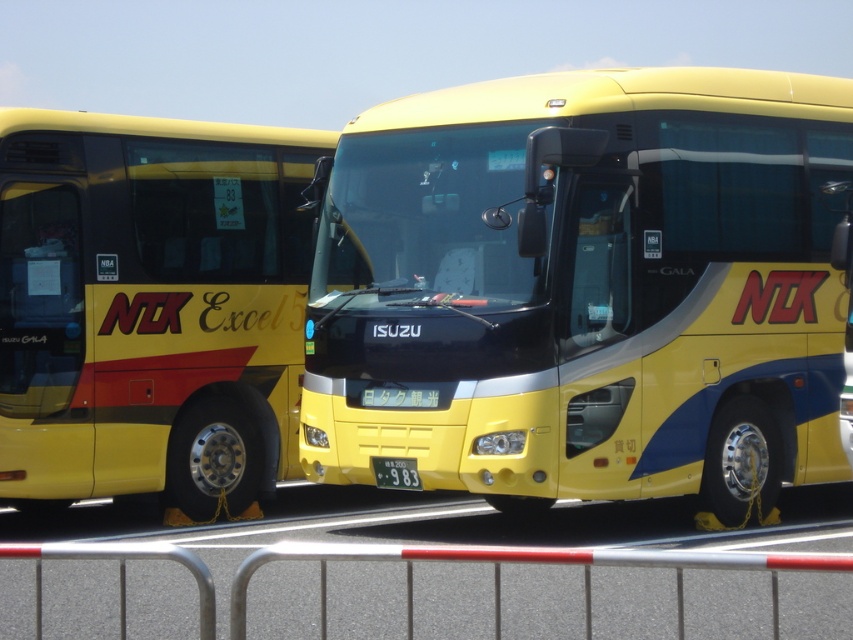
You are a bus driver who needs to park your bus exactly at point 0.453, 0.688. You see the yellow matte bus at center in the image. Can you use it as a reference to park your bus at the correct position?

Yes, the yellow matte bus at center is already positioned at point (585,292), so you can use it as a reference to park your bus at the correct position.

You are a parking attendant and need to fit both buses into a parking space that is exactly 10 meters wide. The yellow matte bus at center and the yellow matte bus at left are both present. If the total width of both buses combined is 12 meters, can they fit into the space if parked side by side?

The yellow matte bus at center is wider than the yellow matte bus at left. Since their combined width is 12 meters, which exceeds the 10 meter parking space, they cannot fit side by side in the space.

You are a pedestrian standing at the entrance of the bus station. You want to walk to the yellow matte bus at center. Which direction should you go relative to the silver metallic rail at lower center?

The yellow matte bus at center is to the right of the silver metallic rail at lower center. So you should walk towards the right side of the silver metallic rail at lower center to reach the yellow matte bus at center.